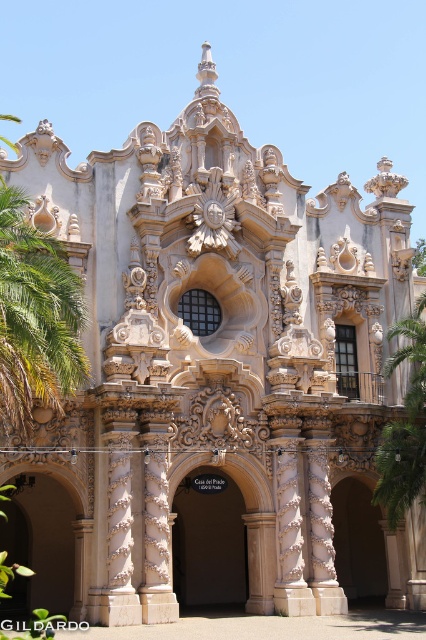
In the scene shown: Is green leafy palm tree at left positioned in front of green leafy palm tree at right?

Yes.

Which is below, green leafy palm tree at left or green leafy palm tree at right?

green leafy palm tree at right is below.

Is point (6, 225) less distant than point (414, 467)?

Yes, point (6, 225) is closer to viewer.

At what (x,y) coordinates should I click in order to perform the action: click on green leafy palm tree at left. Please return your answer as a coordinate pair (x, y). The image size is (426, 640). Looking at the image, I should click on (36, 317).

Does green leafy palm tree at left appear on the left side of brown stone archway at center?

Result: Yes, green leafy palm tree at left is to the left of brown stone archway at center.

Does green leafy palm tree at left appear on the right side of brown stone archway at center?

In fact, green leafy palm tree at left is to the left of brown stone archway at center.

Locate an element on the screen. The height and width of the screenshot is (640, 426). green leafy palm tree at left is located at coordinates (36, 317).

Does brown stone archway at center appear on the left side of green leafy palm tree at right?

Correct, you'll find brown stone archway at center to the left of green leafy palm tree at right.

Image resolution: width=426 pixels, height=640 pixels. Identify the location of brown stone archway at center. (209, 540).

Where is `brown stone archway at center`? brown stone archway at center is located at coordinates (209, 540).